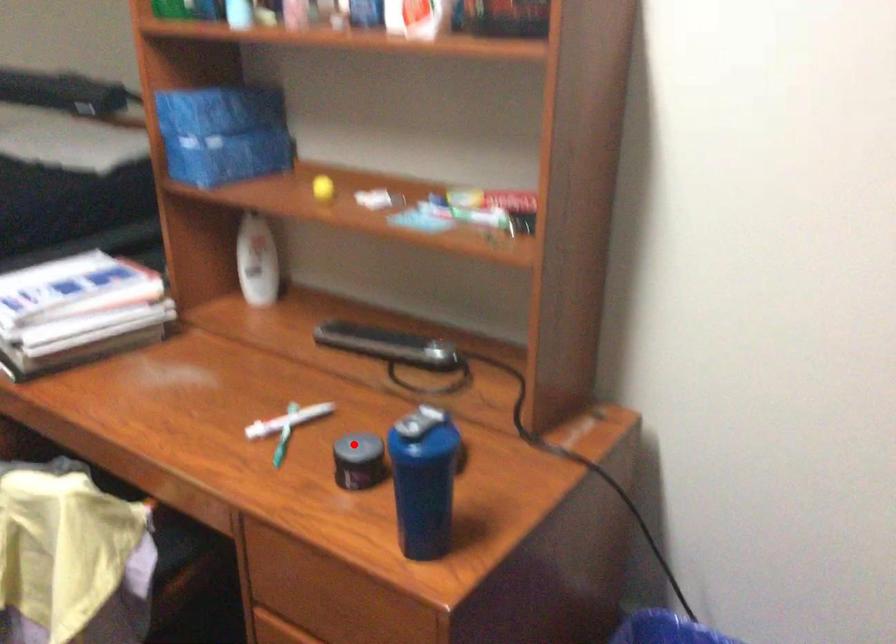
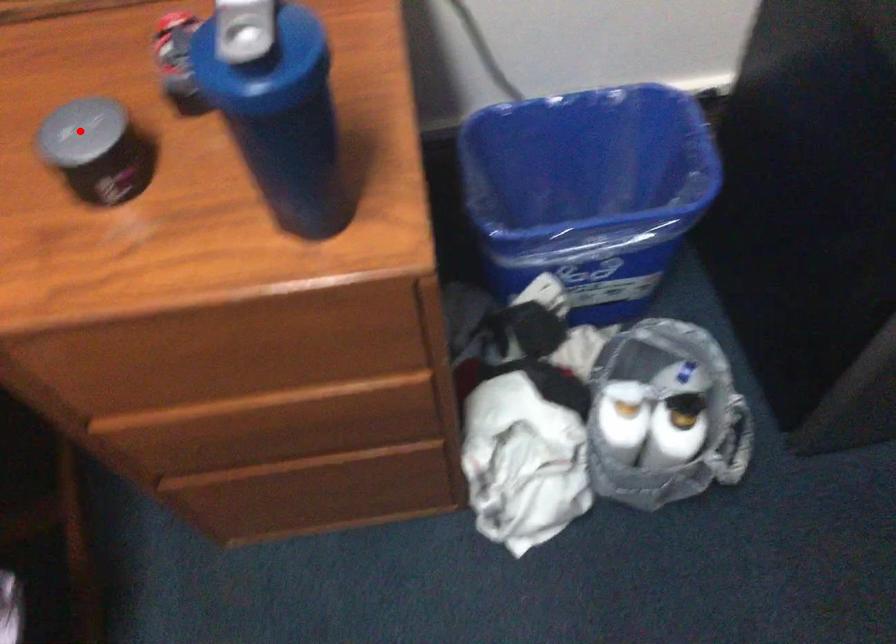
I am providing you with two images of the same scene from different viewpoints. A red point is marked on the first image and another point is marked on the second image. Does the point marked in image1 correspond to the same location as the one in image2?

Yes